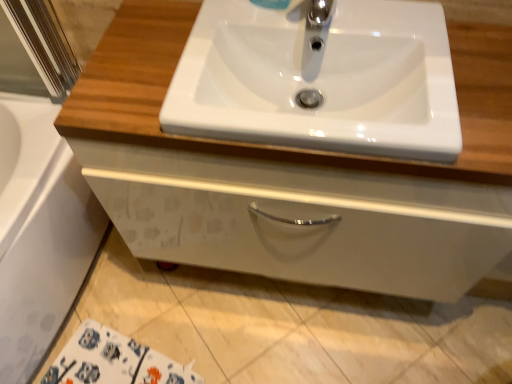
This screenshot has width=512, height=384. In order to click on vacant area that is situated to the right of chrome metallic faucet at upper center in this screenshot , I will do `click(392, 34)`.